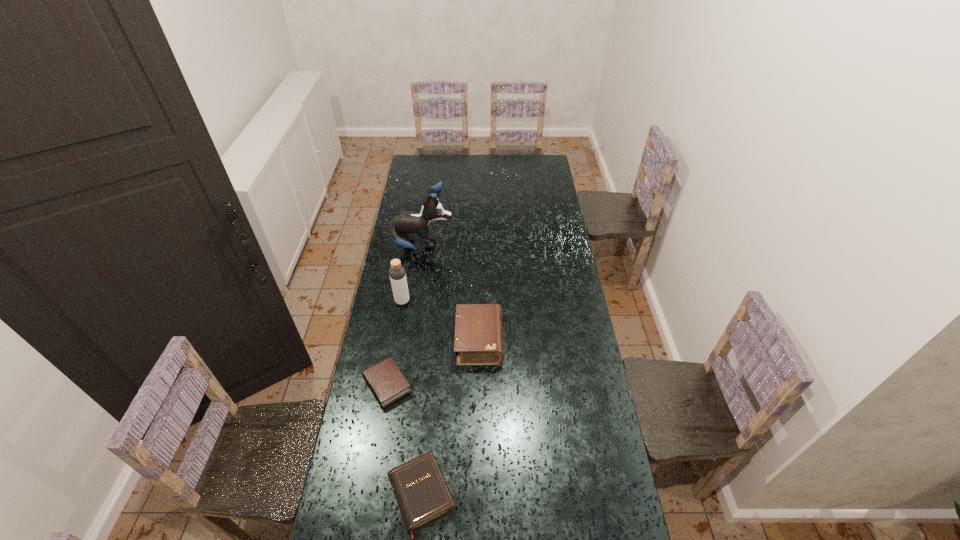
This screenshot has width=960, height=540. What are the coordinates of `Bible that is positioned at the left edge` in the screenshot? It's located at (388, 384).

Locate an element on the screen. free point at the far edge is located at coordinates pyautogui.click(x=504, y=161).

Where is `blank space at the left edge`? This screenshot has height=540, width=960. blank space at the left edge is located at coordinates (405, 202).

I want to click on free space at the right edge, so click(541, 270).

The image size is (960, 540). Find the location of `unoccupied area between the tallest object and the bottle`. unoccupied area between the tallest object and the bottle is located at coordinates (413, 274).

I want to click on unoccupied position between the farthest object and the fourth nearest object, so click(x=413, y=274).

You are a GUI agent. You are given a task and a screenshot of the screen. Output one action in this format:
    pyautogui.click(x=<x>, y=<y>)
    Task: Click on the unoccupied area between the third shortest object and the puppy
    
    Given the screenshot: What is the action you would take?
    pyautogui.click(x=451, y=294)

Locate an element on the screen. The height and width of the screenshot is (540, 960). the second closest object to the nearest Bible is located at coordinates pyautogui.click(x=478, y=340).

Choose which object is the third nearest neighbor to the fourth nearest object. Please provide its 2D coordinates. Your answer should be formatted as a tuple, i.e. [(x, y)], where the tuple contains the x and y coordinates of a point satisfying the conditions above.

[(388, 384)]

Identify the location of the second closest Bible to the tallest Bible. (423, 497).